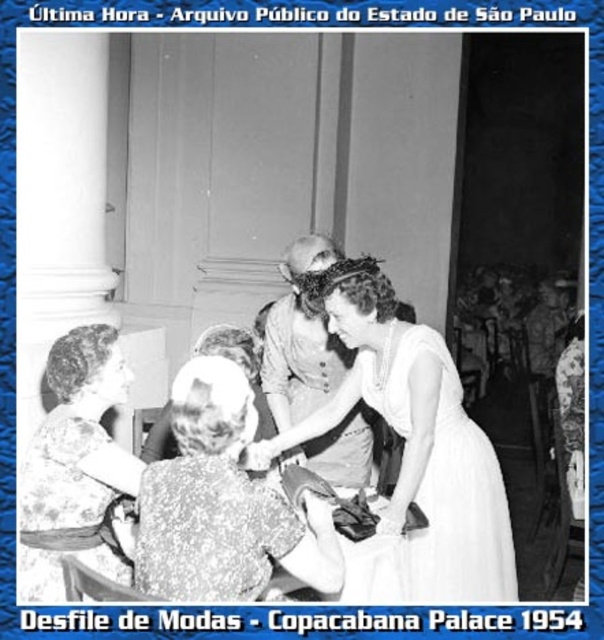
Question: Is matte white dress at center closer to the viewer compared to floral-patterned fabric dress at lower left?

Choices:
 (A) no
 (B) yes

Answer: (B)

Question: Considering the relative positions of smooth fabric dress at center and smooth white hat at center in the image provided, where is smooth fabric dress at center located with respect to smooth white hat at center?

Choices:
 (A) right
 (B) left

Answer: (A)

Question: Based on their relative distances, which object is nearer to the smooth white hat at center?

Choices:
 (A) smooth fabric dress at center
 (B) floral-patterned fabric dress at lower left
 (C) matte white dress at center
 (D) white satin dress at center

Answer: (A)

Question: Based on their relative distances, which object is farther from the smooth fabric dress at center?

Choices:
 (A) smooth white hat at center
 (B) floral-patterned fabric dress at lower left

Answer: (B)

Question: Estimate the real-world distances between objects in this image. Which object is closer to the matte white dress at center?

Choices:
 (A) smooth fabric dress at center
 (B) white satin dress at center
 (C) floral-patterned fabric dress at lower left
 (D) smooth white hat at center

Answer: (C)

Question: Does matte white dress at center appear under smooth fabric dress at center?

Choices:
 (A) yes
 (B) no

Answer: (A)